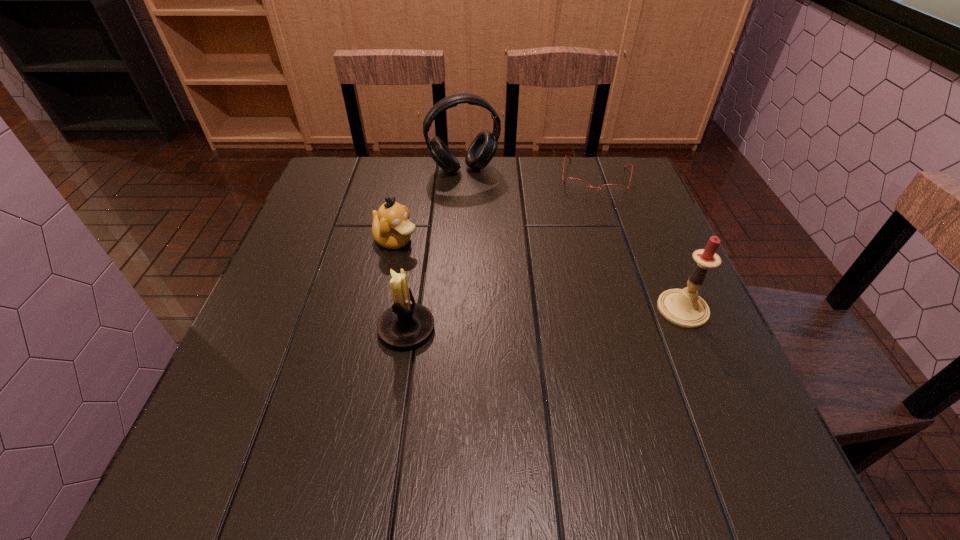
I want to click on vacant space on the desktop that is between the candle holder and the candle and is positioned on the face of the fourth tallest object, so click(x=541, y=319).

Identify the location of free spot on the desktop that is between the candle holder and the candle and is positioned on the earcups of the headset. The image size is (960, 540). (530, 320).

The width and height of the screenshot is (960, 540). I want to click on vacant space on the desktop that is between the candle holder and the candle and is positioned on the lenses of the spectacles, so click(575, 317).